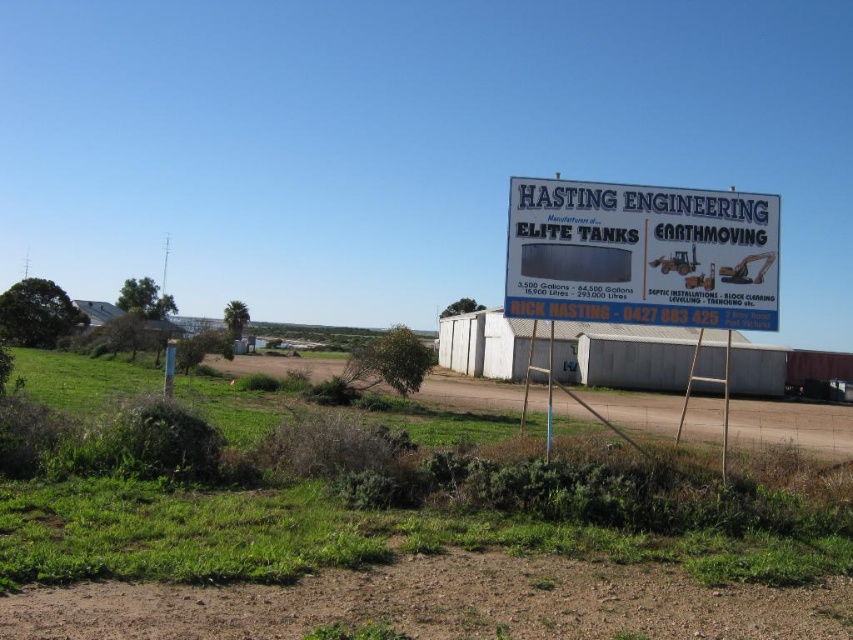
Is brown dirt track at lower center in front of white plastic sign at upper right?

Yes.

Does brown dirt track at lower center have a smaller size compared to white plastic sign at upper right?

Correct, brown dirt track at lower center occupies less space than white plastic sign at upper right.

You are a GUI agent. You are given a task and a screenshot of the screen. Output one action in this format:
    pyautogui.click(x=<x>, y=<y>)
    Task: Click on the brown dirt track at lower center
    
    Given the screenshot: What is the action you would take?
    pyautogui.click(x=442, y=604)

Between brown dirt track at lower center and brown dirt field at lower center, which one appears on the left side from the viewer's perspective?

From the viewer's perspective, brown dirt field at lower center appears more on the left side.

Is point (395, 600) positioned before point (695, 396)?

Yes, it is in front of point (695, 396).

Between point (712, 600) and point (706, 438), which one is positioned behind?

The point (706, 438) is more distant.

I want to click on brown dirt track at lower center, so click(442, 604).

Who is taller, white plastic sign at upper right or brown dirt field at lower center?

With more height is brown dirt field at lower center.

Can you confirm if white plastic sign at upper right is positioned above brown dirt field at lower center?

Yes, white plastic sign at upper right is above brown dirt field at lower center.

Between point (601, 250) and point (751, 417), which one is positioned in front?

Point (601, 250) is more forward.

At what (x,y) coordinates should I click in order to perform the action: click on white plastic sign at upper right. Please return your answer as a coordinate pair (x, y). This screenshot has width=853, height=640. Looking at the image, I should click on (641, 253).